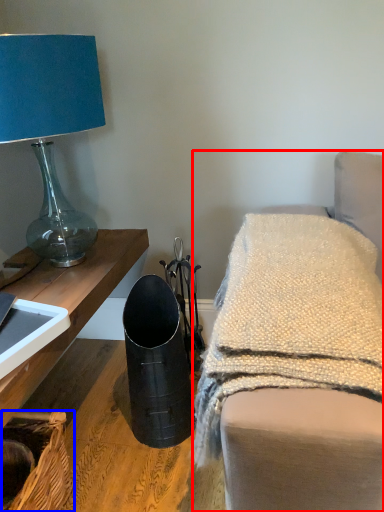
Question: Which of the following is the farthest to the observer, furniture (highlighted by a red box) or basket (highlighted by a blue box)?

Choices:
 (A) furniture
 (B) basket

Answer: (B)